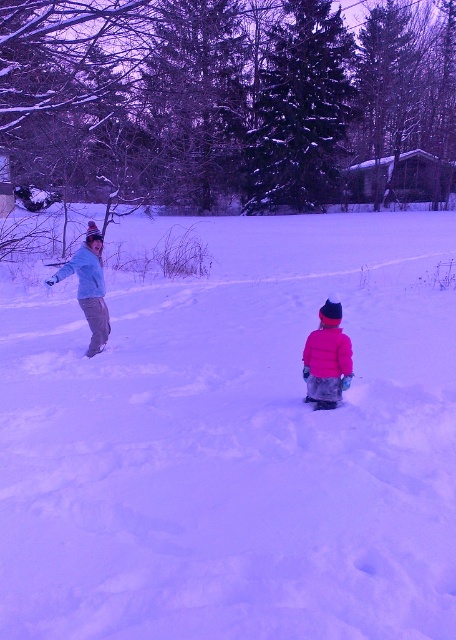
The width and height of the screenshot is (456, 640). In order to click on white fluffy snow at center in this screenshot , I will do `click(234, 442)`.

Image resolution: width=456 pixels, height=640 pixels. What do you see at coordinates (234, 442) in the screenshot?
I see `white fluffy snow at center` at bounding box center [234, 442].

What do you see at coordinates (234, 442) in the screenshot? The height and width of the screenshot is (640, 456). I see `white fluffy snow at center` at bounding box center [234, 442].

The image size is (456, 640). I want to click on white fluffy snow at center, so click(x=234, y=442).

Does white fluffy snow at center have a greater width compared to pink fleece jacket at center?

Indeed, white fluffy snow at center has a greater width compared to pink fleece jacket at center.

The image size is (456, 640). Find the location of `white fluffy snow at center`. white fluffy snow at center is located at coordinates (234, 442).

Between pink fleece jacket at center and matte blue jacket at left, which one is positioned lower?

pink fleece jacket at center is below.

Does pink fleece jacket at center appear on the right side of matte blue jacket at left?

Yes, pink fleece jacket at center is to the right of matte blue jacket at left.

Which is behind, point (321, 401) or point (94, 248)?

Positioned behind is point (94, 248).

You are a GUI agent. You are given a task and a screenshot of the screen. Output one action in this format:
    pyautogui.click(x=<x>, y=<y>)
    Task: Click on the pink fleece jacket at center
    
    Given the screenshot: What is the action you would take?
    pyautogui.click(x=326, y=358)